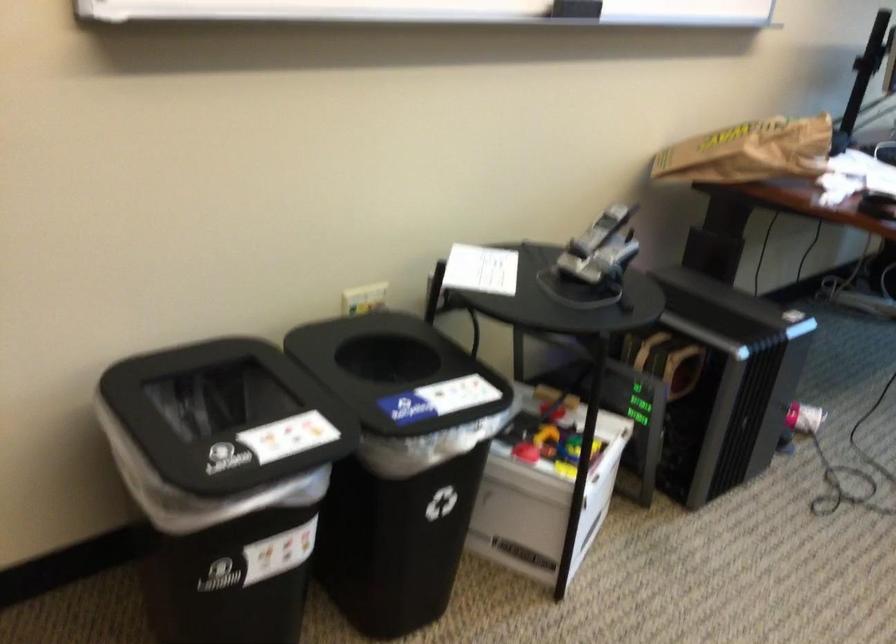
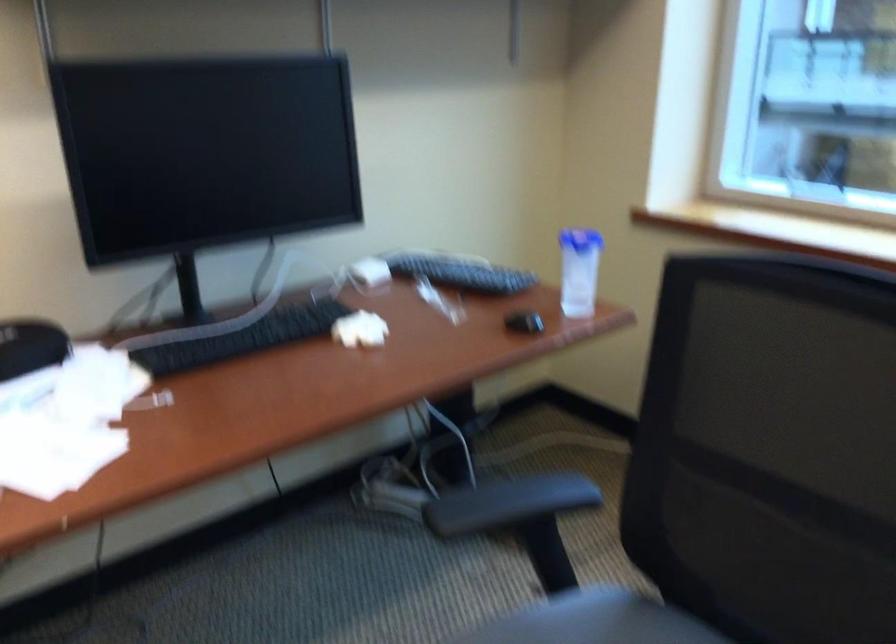
In a continuous first-person perspective shot, in which direction is the camera moving?

The cameraman moved toward right, forward.